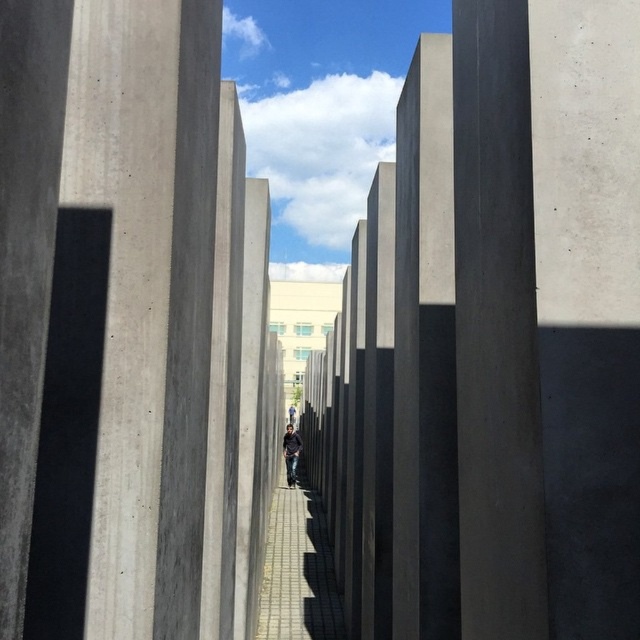
Question: Considering the relative positions of smooth concrete pillar at center and dark blue jeans at center in the image provided, where is smooth concrete pillar at center located with respect to dark blue jeans at center?

Choices:
 (A) right
 (B) left

Answer: (A)

Question: Which object appears closest to the camera in this image?

Choices:
 (A) gray brick pavement at center
 (B) dark blue jeans at center

Answer: (A)

Question: Which point is closer to the camera taking this photo?

Choices:
 (A) (304, 564)
 (B) (460, 86)

Answer: (B)

Question: Which point is farther to the camera?

Choices:
 (A) (285, 433)
 (B) (470, 561)

Answer: (A)

Question: From the image, what is the correct spatial relationship of gray brick pavement at center in relation to dark blue jeans at center?

Choices:
 (A) above
 (B) below

Answer: (A)

Question: Is smooth concrete pillar at center positioned before dark blue jeans at center?

Choices:
 (A) yes
 (B) no

Answer: (A)